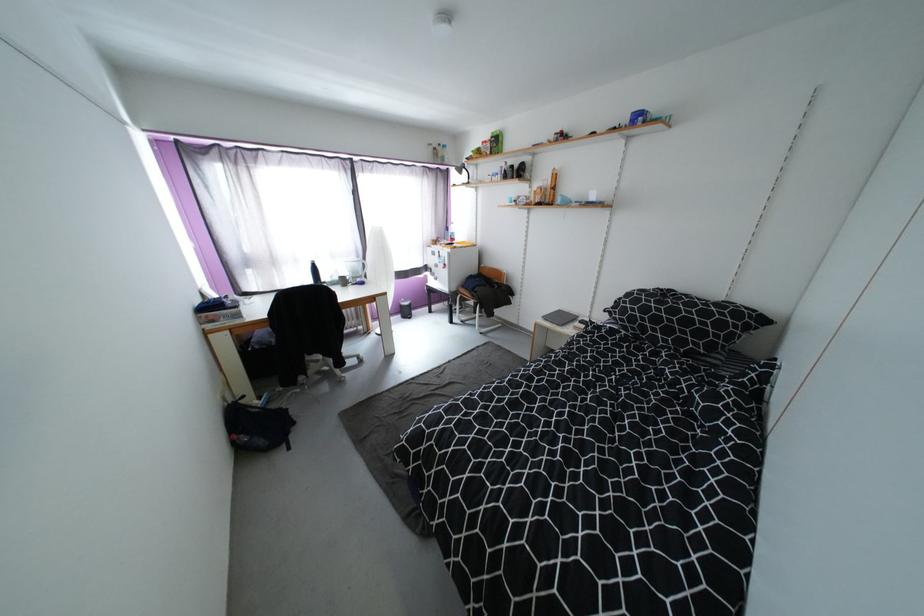
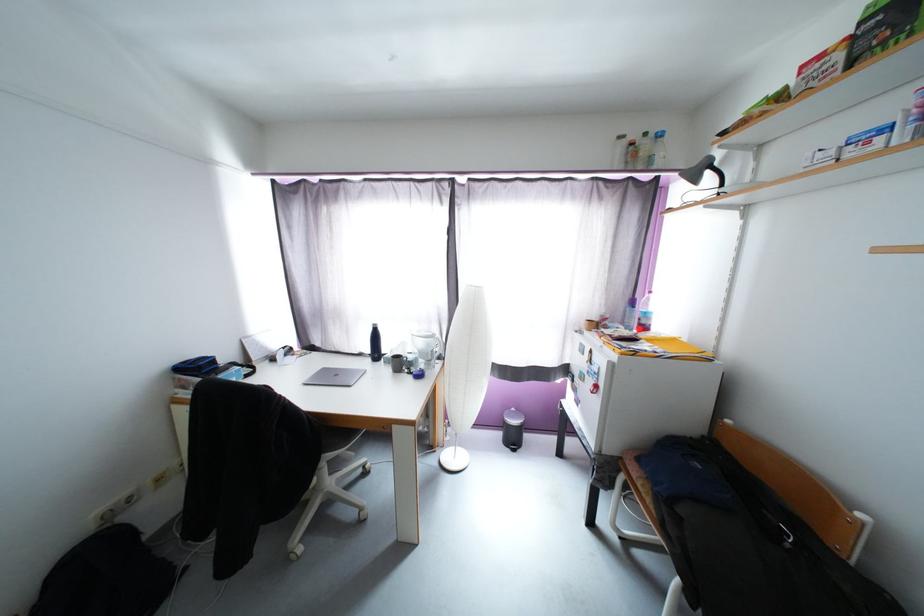
Locate, in the second image, the point that corresponds to point (481, 292) in the first image.

(687, 512)